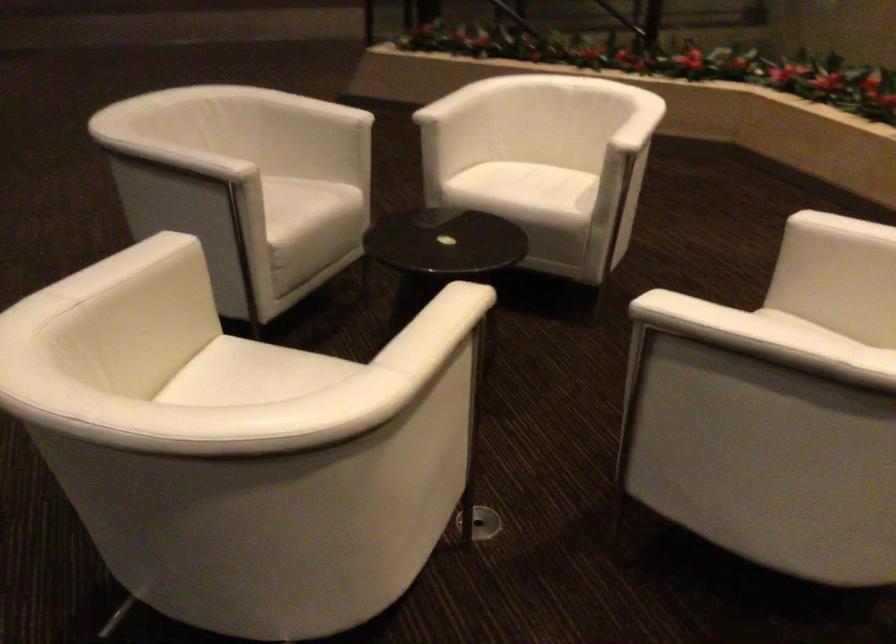
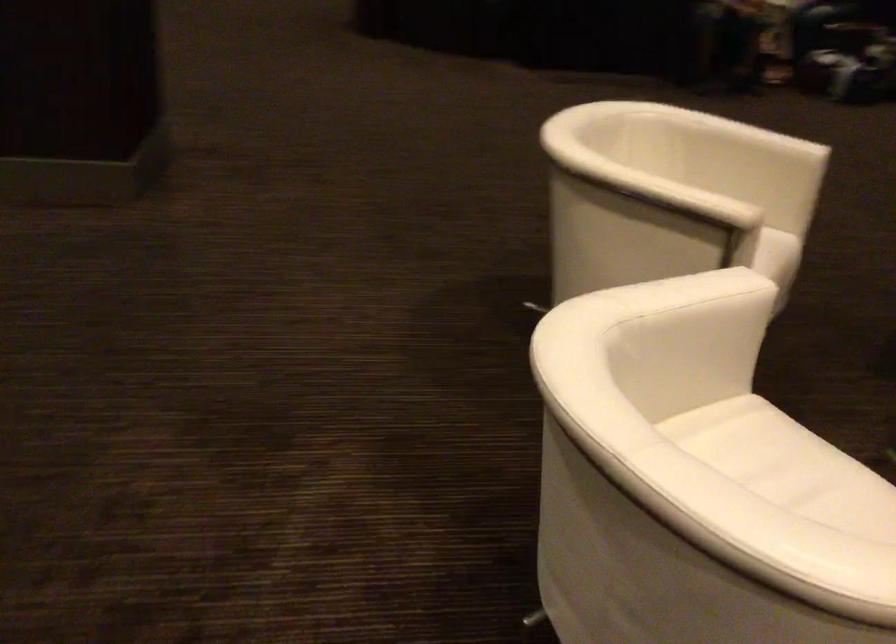
In the second image, find the point that corresponds to [458,328] in the first image.

(675, 194)